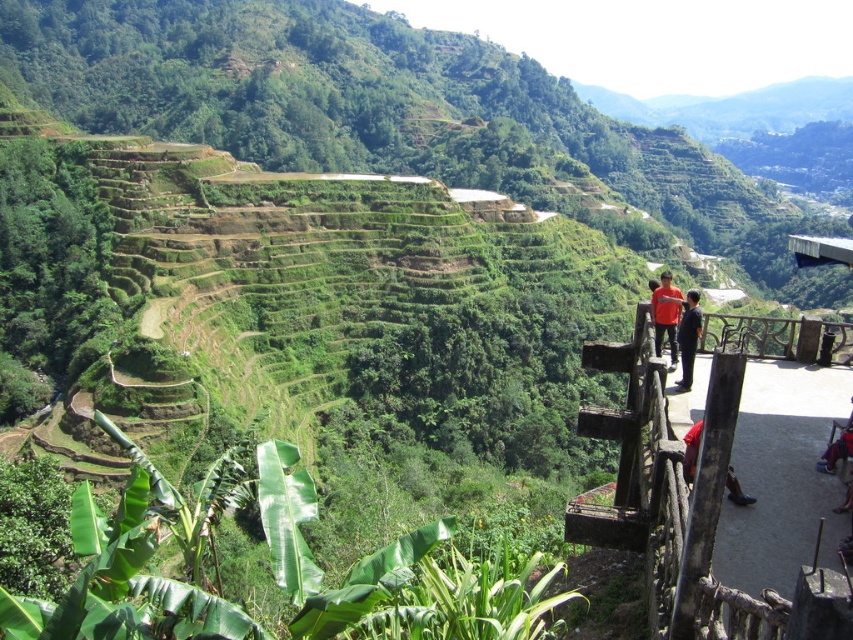
From the picture: You are standing at the viewpoint overlooking the terraced fields and notice two people in the foreground near the wooden railing. One is wearing an orange shirt at center and the other a black smooth shirt at upper center. From your perspective, which shirt is positioned to the left?

The orange shirt at center is positioned to the left of the black smooth shirt at upper center.

From the picture: You are standing at the viewpoint overlooking the terraced fields and notice a person wearing an orange shirt and dark blue jeans. Based on their position, can you determine if the orange shirt at center is higher or lower than the dark blue jeans at lower right?

The orange shirt at center is above dark blue jeans at lower right, so the orange shirt is higher.